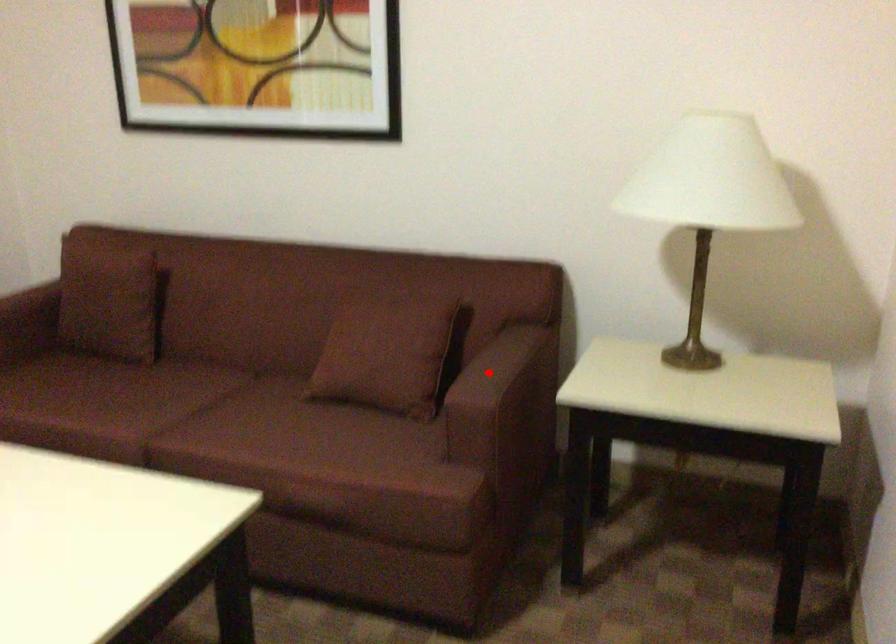
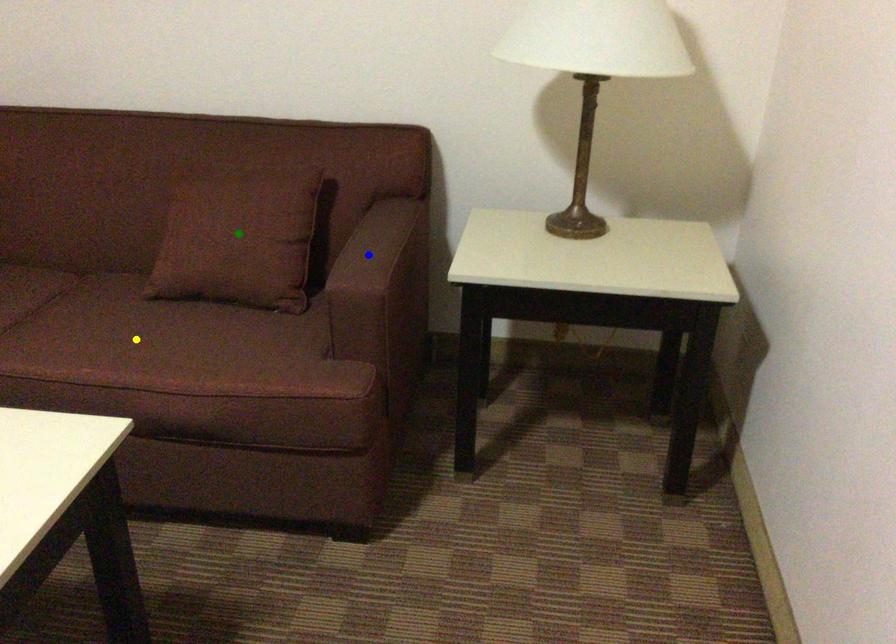
Question: I am providing you with two images of the same scene from different viewpoints. A red point is marked on the first image. You are given multiple points on the second image. Which mark in image 2 goes with the point in image 1?

Choices:
 (A) green point
 (B) yellow point
 (C) blue point

Answer: (C)